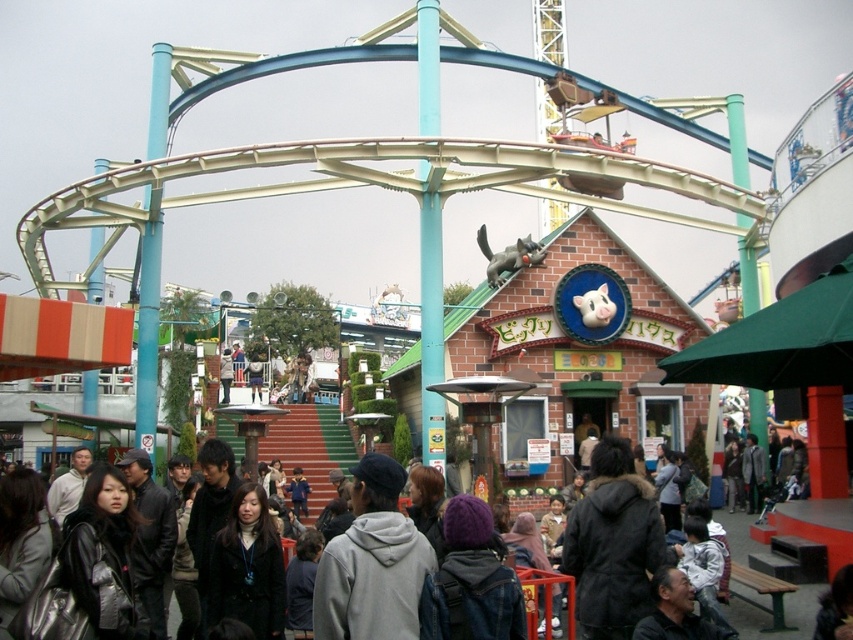
Question: Which point is farther to the camera?

Choices:
 (A) gray hoodie at center
 (B) dark gray hoodie at center

Answer: (B)

Question: Is gray hoodie at center to the left of dark gray hoodie at center from the viewer's perspective?

Choices:
 (A) no
 (B) yes

Answer: (B)

Question: Where is gray hoodie at center located in relation to dark gray hoodie at center in the image?

Choices:
 (A) right
 (B) left

Answer: (B)

Question: Does gray hoodie at center have a smaller size compared to dark gray hoodie at center?

Choices:
 (A) no
 (B) yes

Answer: (B)